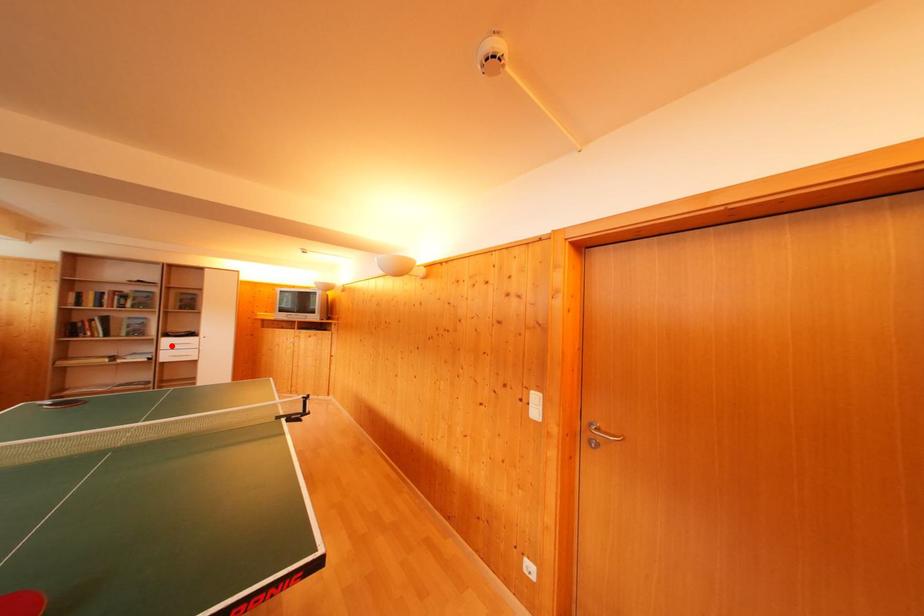
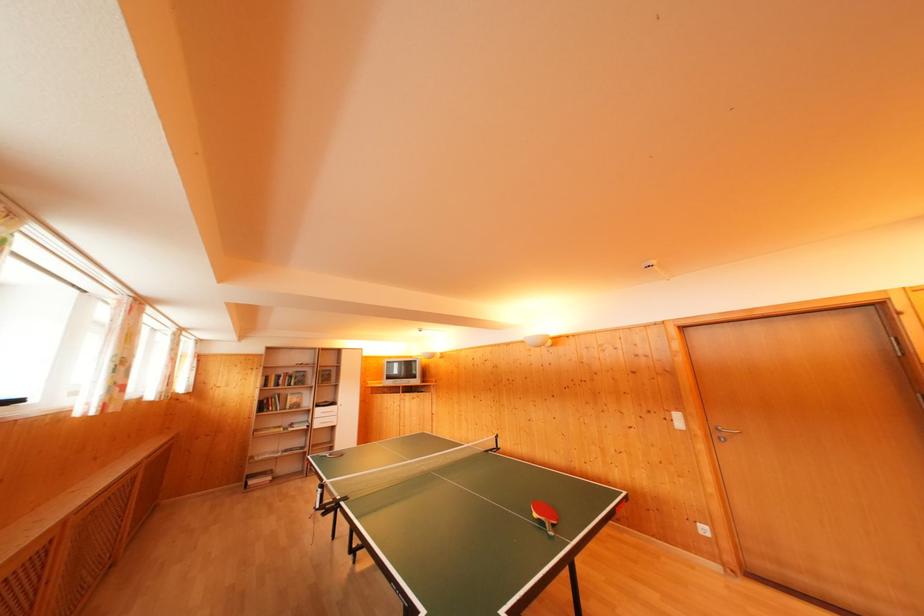
The point at the highlighted location is marked in the first image. Where is the corresponding point in the second image?

(322, 416)